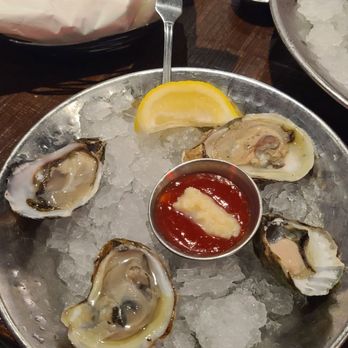
Where is `woodgrain table top`? woodgrain table top is located at coordinates (238, 54).